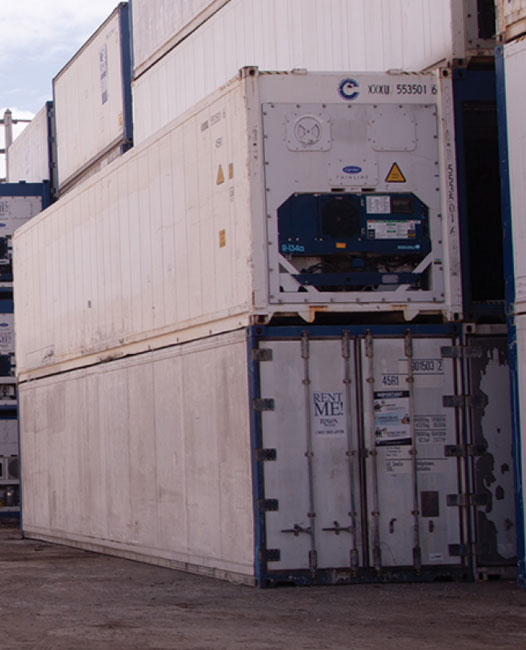
This screenshot has width=526, height=650. I want to click on latch, so click(337, 526), click(295, 530).